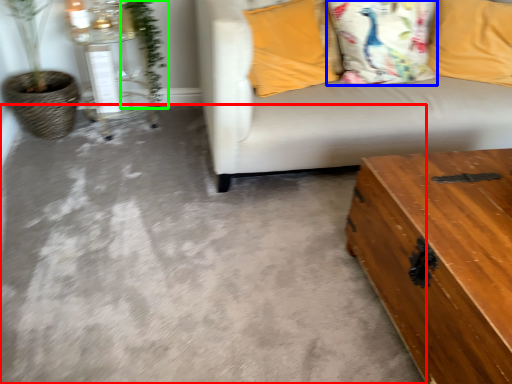
Question: Considering the real-world distances, which object is closest to concrete (highlighted by a red box)? pillow (highlighted by a blue box) or plant (highlighted by a green box).

Choices:
 (A) pillow
 (B) plant

Answer: (A)